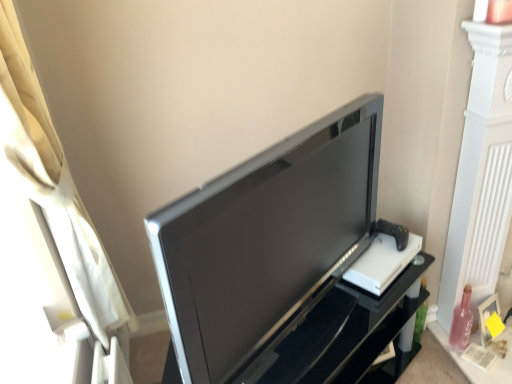
Question: From the image's perspective, is satin black tv at center located above or below pink glass bottle at lower right?

Choices:
 (A) below
 (B) above

Answer: (A)

Question: Is point (306, 317) positioned closer to the camera than point (470, 289)?

Choices:
 (A) closer
 (B) farther

Answer: (A)

Question: Considering the real-world distances, which object is closest to the white fabric curtain at left?

Choices:
 (A) satin black tv at center
 (B) pink glass bottle at lower right
 (C) satin black television at center

Answer: (C)

Question: Which object is positioned farthest from the satin black television at center?

Choices:
 (A) white fabric curtain at left
 (B) pink glass bottle at lower right
 (C) satin black tv at center

Answer: (B)